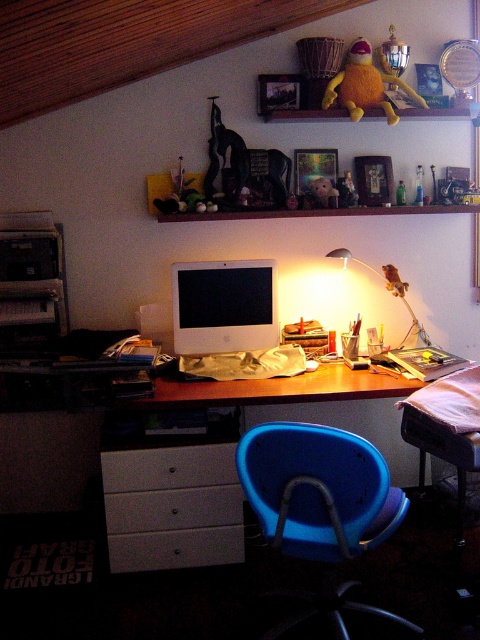
Question: In this image, where is white matte computer desk at center located relative to white matte drawer at lower center?

Choices:
 (A) left
 (B) right

Answer: (B)

Question: Which of these objects is positioned farthest from the white glossy drawer at lower center?

Choices:
 (A) matte white monitor at center
 (B) metallic silver desk lamp at center-right
 (C) white matte drawer at lower center

Answer: (B)

Question: Does blue plastic swivel chair at center have a greater width compared to white matte drawer at lower center?

Choices:
 (A) no
 (B) yes

Answer: (B)

Question: From the image, what is the correct spatial relationship of blue plastic swivel chair at center in relation to white matte drawer at lower left?

Choices:
 (A) left
 (B) right

Answer: (B)

Question: Which of the following is the farthest from the observer?

Choices:
 (A) yellow plush toy at upper center
 (B) white matte drawer at lower center

Answer: (A)

Question: Estimate the real-world distances between objects in this image. Which object is farther from the yellow plush toy at upper center?

Choices:
 (A) white matte computer desk at center
 (B) white glossy drawer at lower center
 (C) metallic silver desk lamp at center-right

Answer: (B)